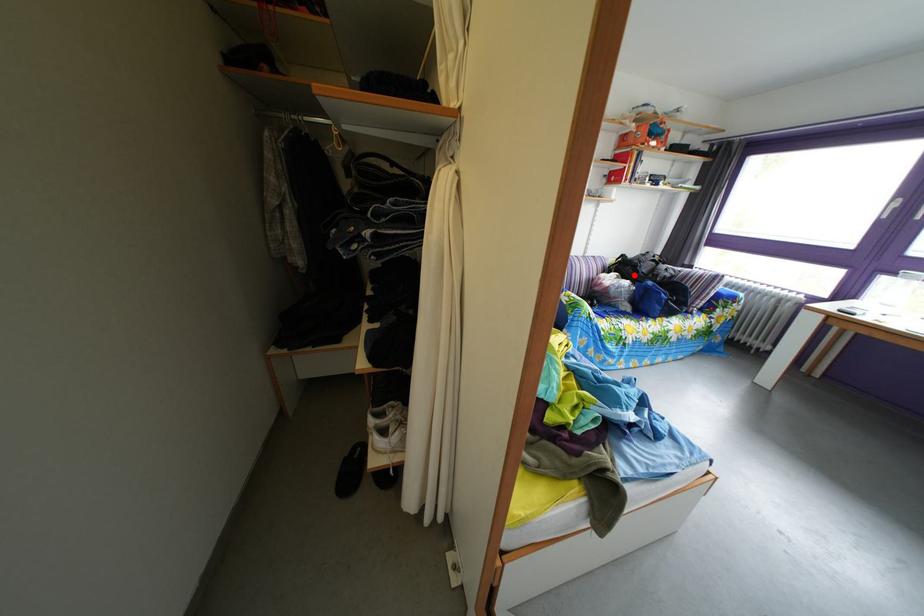
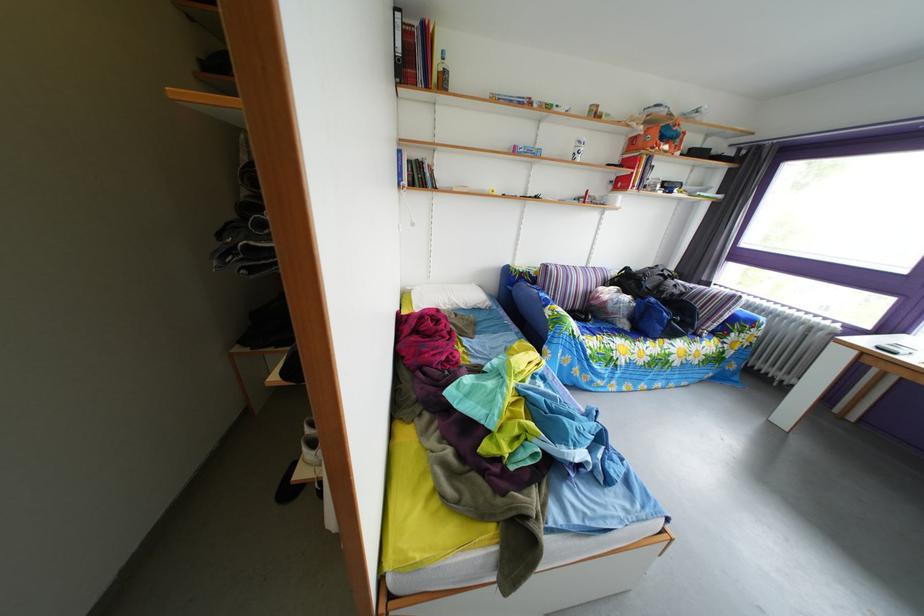
Locate, in the second image, the point that corresponds to the highlighted location in the first image.

(638, 289)